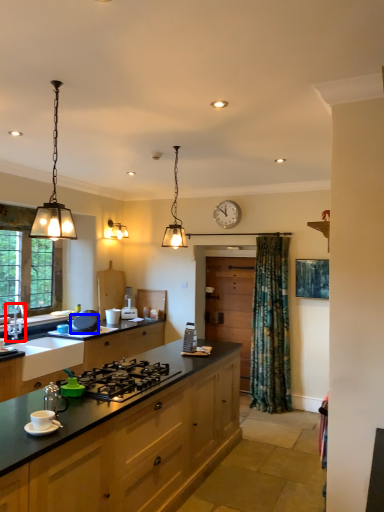
Question: Which object is closer to the camera taking this photo, tap (highlighted by a red box) or appliance (highlighted by a blue box)?

Choices:
 (A) tap
 (B) appliance

Answer: (A)